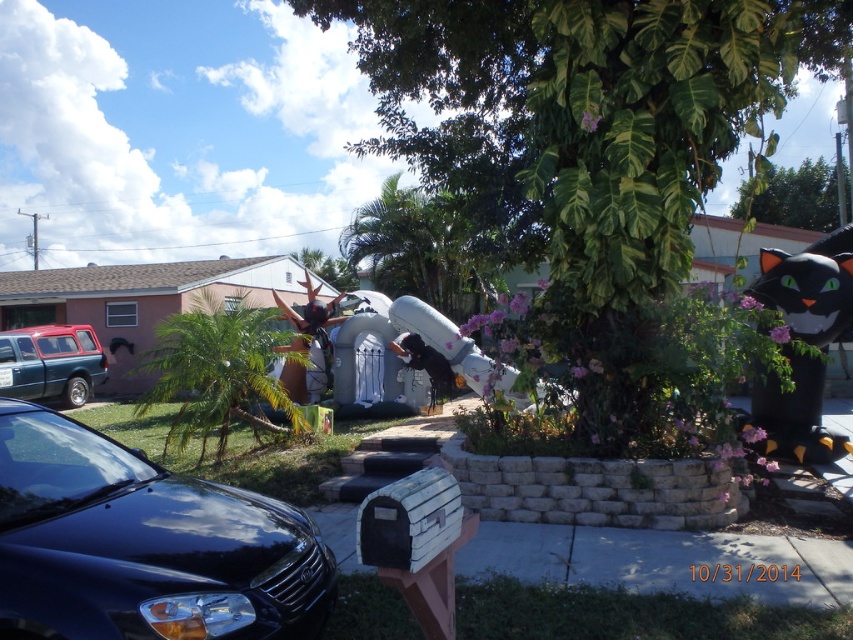
You are a delivery person trying to park your 12 feet long delivery van in the driveway. The driveway is between the metallic red station wagon at left and the shiny metallic reindeer at center. Can you fit your van there?

The metallic red station wagon at left is smaller than the shiny metallic reindeer at center. However, the exact distance between them is not provided, so it is impossible to determine if the 12 feet van can fit in the driveway between them.